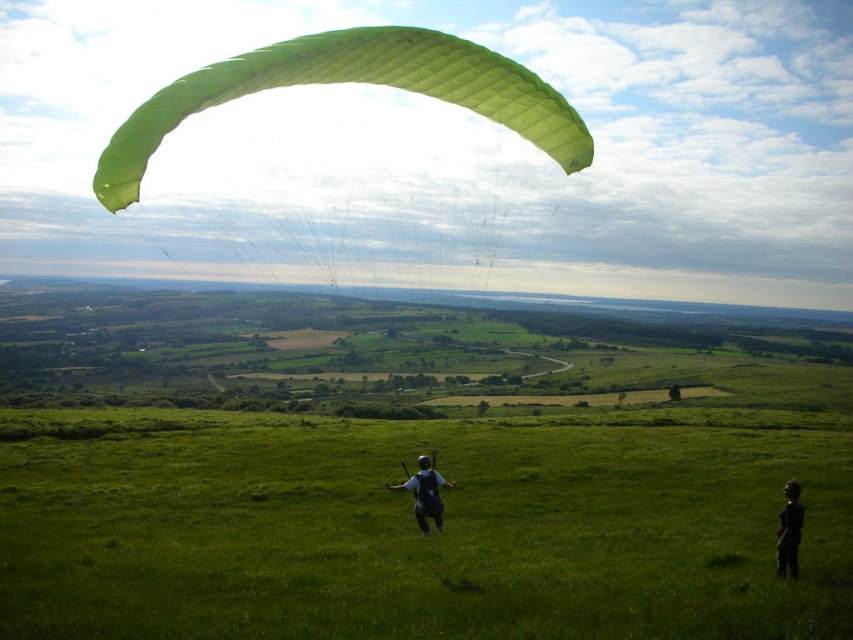
Question: Can you confirm if green grassy field at center is smaller than dark fabric person at lower right?

Choices:
 (A) yes
 (B) no

Answer: (B)

Question: Can you confirm if green grassy field at center is bigger than dark fabric person at lower right?

Choices:
 (A) yes
 (B) no

Answer: (A)

Question: Among these objects, which one is nearest to the camera?

Choices:
 (A) green grassy field at center
 (B) green fabric parachute at upper center
 (C) black fabric parachute at center

Answer: (A)

Question: Which of the following is the closest to the observer?

Choices:
 (A) dark fabric person at lower right
 (B) green grassy field at center
 (C) black fabric parachute at center

Answer: (B)

Question: Which point is farther from the camera taking this photo?

Choices:
 (A) (410, 486)
 (B) (793, 531)
 (C) (653, 548)

Answer: (C)

Question: Is green grassy field at center in front of dark fabric person at lower right?

Choices:
 (A) yes
 (B) no

Answer: (A)